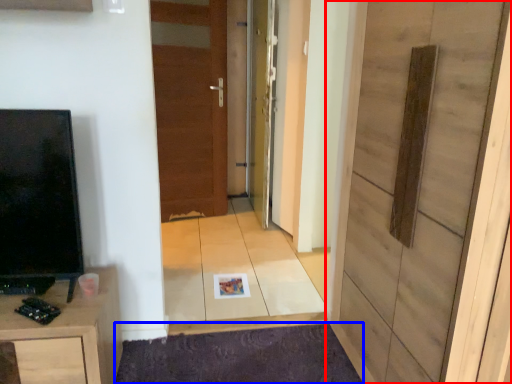
Question: Which object is further to the camera taking this photo, door (highlighted by a red box) or doormat (highlighted by a blue box)?

Choices:
 (A) door
 (B) doormat

Answer: (B)